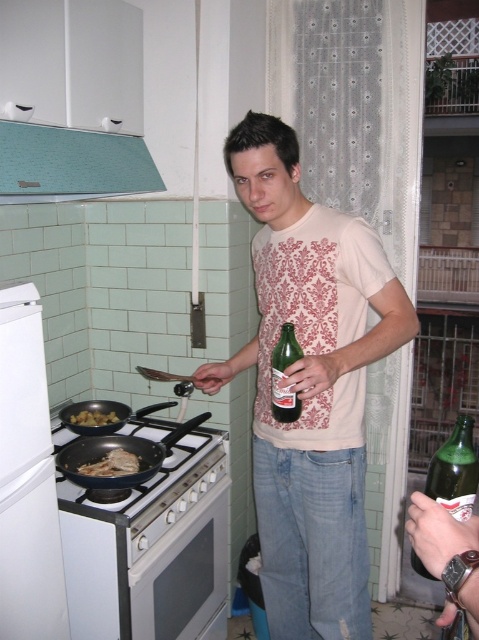
Question: Considering the real-world distances, which object is farthest from the green glass bottle at center?

Choices:
 (A) white glossy stove at lower left
 (B) white matte refrigerator at left

Answer: (A)

Question: Which point is closer to the camera?

Choices:
 (A) teal fabric exhaust hood at upper left
 (B) white matte refrigerator at left

Answer: (B)

Question: Which point appears closest to the camera in this image?

Choices:
 (A) (98, 412)
 (B) (71, 500)
 (C) (33, 465)

Answer: (C)

Question: Does white matte refrigerator at left have a greater width compared to teal fabric exhaust hood at upper left?

Choices:
 (A) no
 (B) yes

Answer: (A)

Question: Is white glossy oven at lower center below black non-stick frying pan at stove?

Choices:
 (A) yes
 (B) no

Answer: (A)

Question: Does white glossy stove at lower left appear on the left side of green glass bottle at lower right?

Choices:
 (A) yes
 (B) no

Answer: (A)